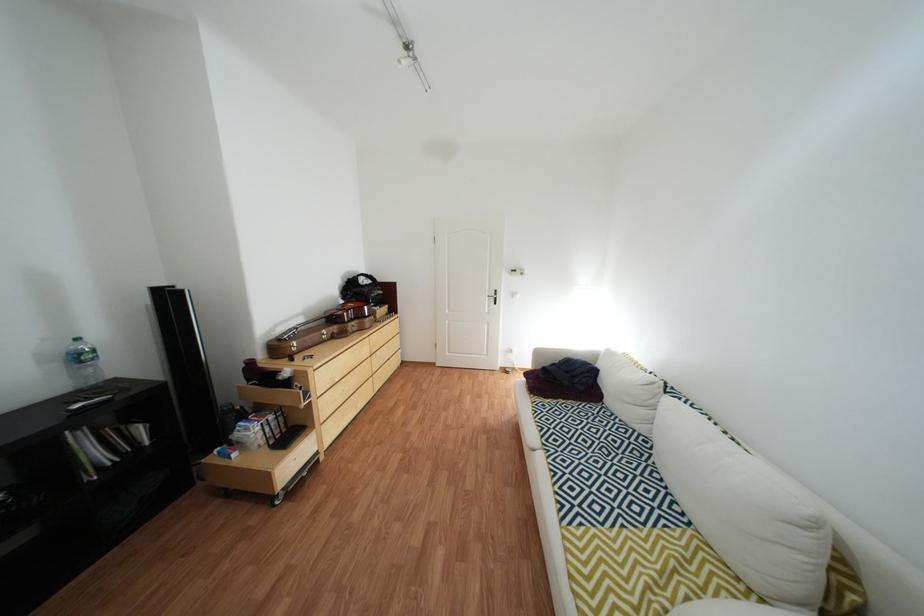
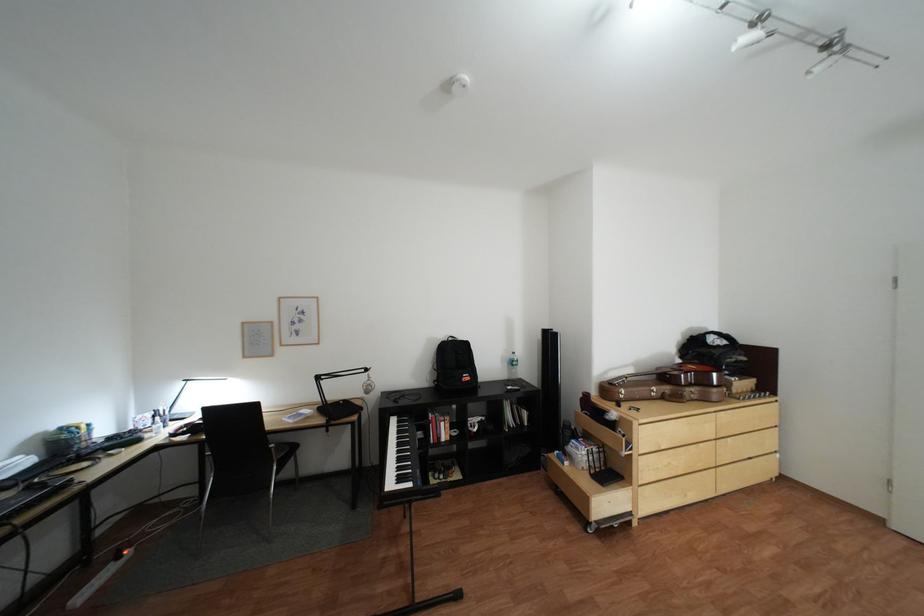
In the second image, find the point that corresponds to point (366, 326) in the first image.

(703, 391)